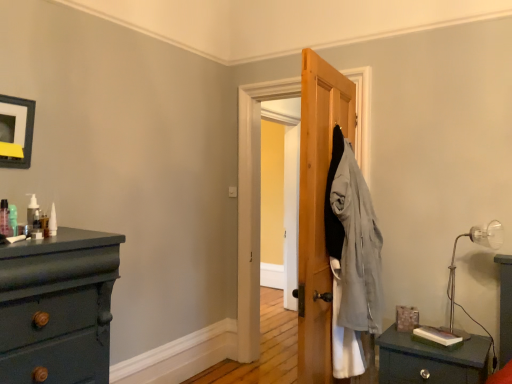
Question: From a real-world perspective, does translucent plastic pump at left, which ranks as the first toiletry in left-to-right order, stand above white matte bottle at upper left, placed as the third toiletry when sorted from front to back?

Choices:
 (A) yes
 (B) no

Answer: (A)

Question: From a real-world perspective, is translucent plastic pump at left, which ranks as the first toiletry in left-to-right order, located beneath white matte bottle at upper left, placed as the third toiletry when sorted from front to back?

Choices:
 (A) no
 (B) yes

Answer: (A)

Question: From the image's perspective, is translucent plastic pump at left, which is the 3th toiletry from back to front, on top of white matte bottle at upper left, arranged as the first toiletry when viewed from the right?

Choices:
 (A) no
 (B) yes

Answer: (B)

Question: Is translucent plastic pump at left, which ranks as the first toiletry in left-to-right order, bigger than white matte bottle at upper left, placed as the third toiletry when sorted from front to back?

Choices:
 (A) yes
 (B) no

Answer: (A)

Question: Is translucent plastic pump at left, which is the 3th toiletry from back to front, to the right of white matte bottle at upper left, placed as the third toiletry when sorted from front to back, from the viewer's perspective?

Choices:
 (A) no
 (B) yes

Answer: (A)

Question: Does translucent plastic pump at left, which ranks as the first toiletry in left-to-right order, have a greater height compared to white matte bottle at upper left, placed as the third toiletry when sorted from front to back?

Choices:
 (A) no
 (B) yes

Answer: (B)

Question: Can you confirm if metallic silver table lamp at right is positioned to the right of matte black picture frame at upper left?

Choices:
 (A) no
 (B) yes

Answer: (B)

Question: From a real-world perspective, does metallic silver table lamp at right sit lower than matte black picture frame at upper left?

Choices:
 (A) yes
 (B) no

Answer: (A)

Question: From the image's perspective, is metallic silver table lamp at right on matte black picture frame at upper left?

Choices:
 (A) yes
 (B) no

Answer: (B)

Question: Considering the relative positions of metallic silver table lamp at right and matte black picture frame at upper left in the image provided, is metallic silver table lamp at right to the left of matte black picture frame at upper left from the viewer's perspective?

Choices:
 (A) yes
 (B) no

Answer: (B)

Question: Is metallic silver table lamp at right placed right next to matte black picture frame at upper left?

Choices:
 (A) no
 (B) yes

Answer: (A)

Question: Is metallic silver table lamp at right bigger than matte black picture frame at upper left?

Choices:
 (A) no
 (B) yes

Answer: (B)

Question: Considering the relative sizes of translucent plastic pump at left, marked as the 2th toiletry in a left-to-right arrangement, and matte black nightstand at lower right in the image provided, is translucent plastic pump at left, marked as the 2th toiletry in a left-to-right arrangement, wider than matte black nightstand at lower right?

Choices:
 (A) no
 (B) yes

Answer: (A)